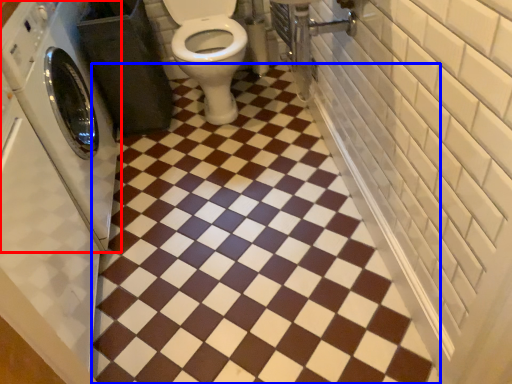
Question: Which point is further to the camera, washing machine (highlighted by a red box) or ceramic tile (highlighted by a blue box)?

Choices:
 (A) washing machine
 (B) ceramic tile

Answer: (B)